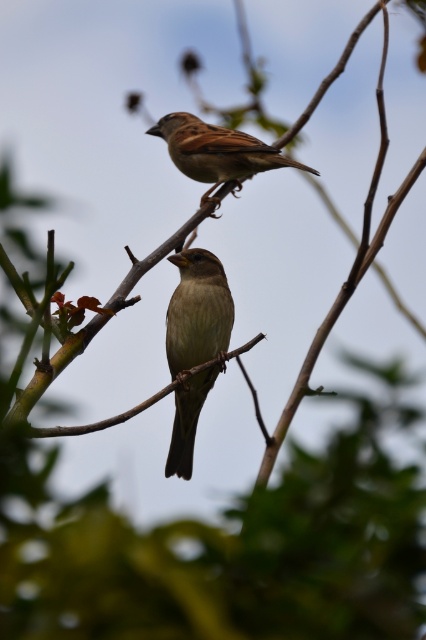
Question: Does brown matte sparrow at center have a greater width compared to brown matte sparrow at upper center?

Choices:
 (A) yes
 (B) no

Answer: (B)

Question: Is brown matte sparrow at center above brown matte sparrow at upper center?

Choices:
 (A) yes
 (B) no

Answer: (B)

Question: Observing the image, what is the correct spatial positioning of brown matte sparrow at center in reference to brown matte sparrow at upper center?

Choices:
 (A) above
 (B) below

Answer: (B)

Question: Among these points, which one is farthest from the camera?

Choices:
 (A) (212, 259)
 (B) (207, 166)

Answer: (B)